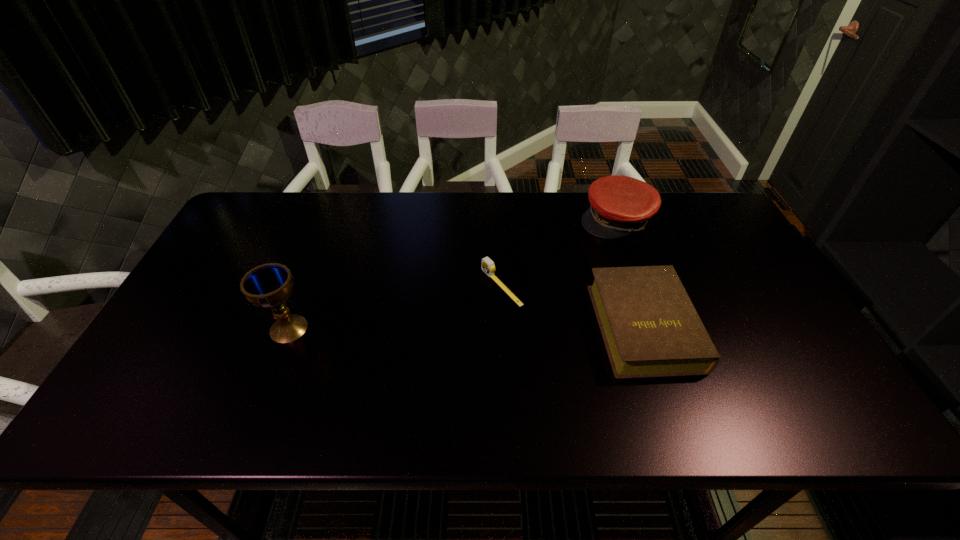
Locate an element on the screen. blank space located 0.090m at the front of the tape measure with the tape extended is located at coordinates (457, 312).

Find the location of a particular element. The width and height of the screenshot is (960, 540). vacant point located at the front of the tape measure with the tape extended is located at coordinates (379, 351).

Find the location of a particular element. This screenshot has width=960, height=540. free space located 0.290m on the front of the second tallest object with an emblem is located at coordinates (541, 286).

Where is `vacant space positioned 0.340m on the front of the second tallest object with an emblem`? vacant space positioned 0.340m on the front of the second tallest object with an emblem is located at coordinates (531, 296).

The width and height of the screenshot is (960, 540). In order to click on blank space located on the front of the second tallest object with an emblem in this screenshot , I will do `click(544, 284)`.

I want to click on object that is at the far edge, so [620, 205].

This screenshot has width=960, height=540. I want to click on object situated at the near edge, so 650,328.

The image size is (960, 540). In order to click on vacant region at the far edge in this screenshot , I will do `click(535, 225)`.

Locate an element on the screen. The image size is (960, 540). vacant region at the near edge of the desktop is located at coordinates (547, 363).

You are a GUI agent. You are given a task and a screenshot of the screen. Output one action in this format:
    pyautogui.click(x=<x>, y=<y>)
    Task: Click on the free point at the left edge
    This screenshot has height=540, width=960.
    Given the screenshot: What is the action you would take?
    pyautogui.click(x=186, y=352)